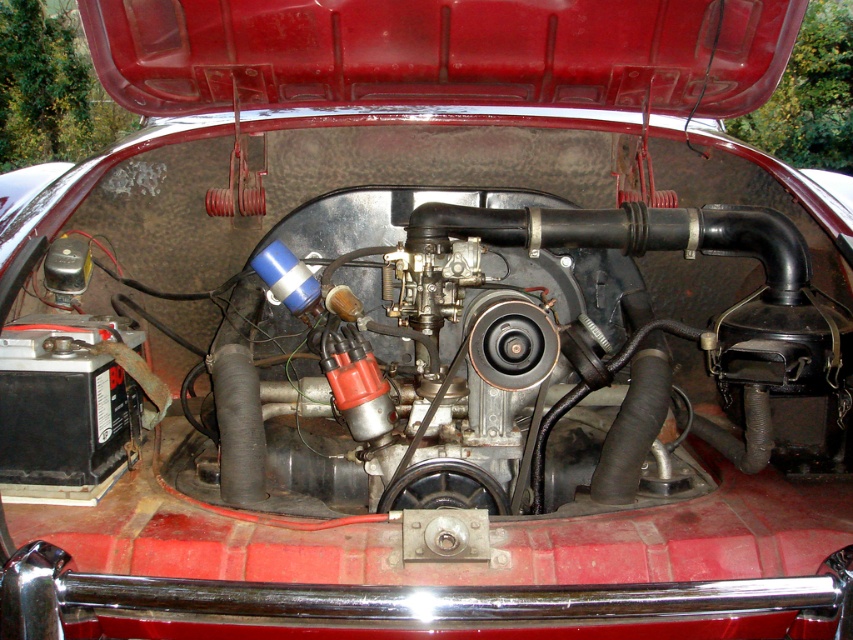
You are a mechanic working on a vintage car. You need to access the metallic silver engine at center. However, the smooth red hood at upper center is blocking your view. Can you lower the hood to access the engine?

The metallic silver engine at center is in front of the smooth red hood at upper center, which means the hood is above the engine. Lowering the hood would allow you to access the engine by providing better visibility and space.